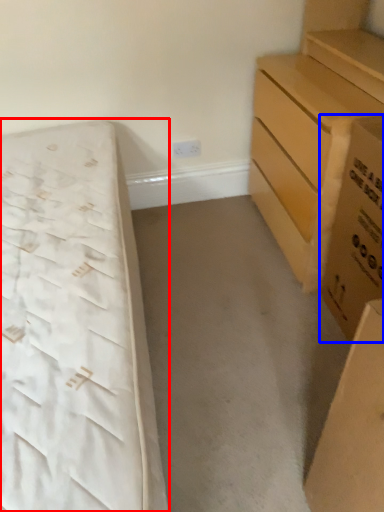
Question: Which object appears farthest to the camera in this image, bed (highlighted by a red box) or cardboard box (highlighted by a blue box)?

Choices:
 (A) bed
 (B) cardboard box

Answer: (B)